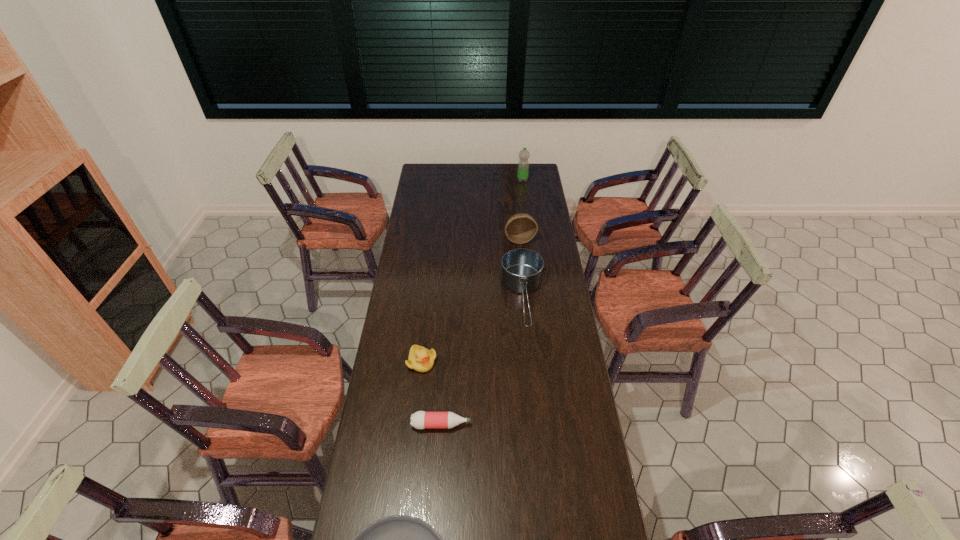
The height and width of the screenshot is (540, 960). Find the location of `water bottle`. water bottle is located at coordinates (523, 166).

Where is `the tallest object`? The width and height of the screenshot is (960, 540). the tallest object is located at coordinates (523, 166).

This screenshot has width=960, height=540. What are the coordinates of `the fifth nearest object` in the screenshot? It's located at (520, 228).

You are a GUI agent. You are given a task and a screenshot of the screen. Output one action in this format:
    pyautogui.click(x=<x>, y=<y>)
    Task: Click on the fifth shortest object
    
    Given the screenshot: What is the action you would take?
    pyautogui.click(x=520, y=228)

The width and height of the screenshot is (960, 540). I want to click on the third tallest object, so pos(521,269).

Where is `the third farthest object`? The image size is (960, 540). the third farthest object is located at coordinates (521, 269).

Image resolution: width=960 pixels, height=540 pixels. Find the location of `the third shortest object`. the third shortest object is located at coordinates (421, 359).

The image size is (960, 540). Find the location of `duckling`. duckling is located at coordinates (421, 359).

The image size is (960, 540). In order to click on the fifth farthest object in this screenshot , I will do `click(420, 420)`.

Find the location of a particular element. the second shortest object is located at coordinates (420, 420).